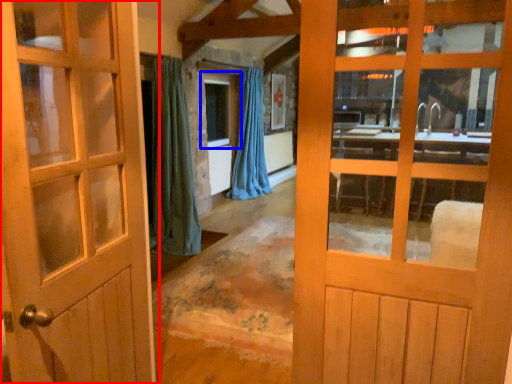
Question: Which point is further to the camera, door (highlighted by a red box) or window (highlighted by a blue box)?

Choices:
 (A) door
 (B) window

Answer: (B)